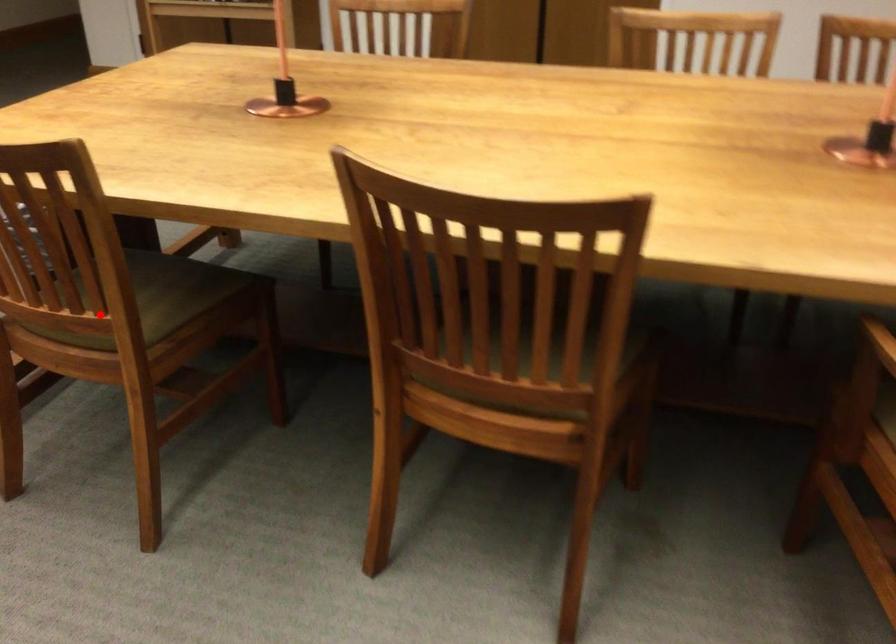
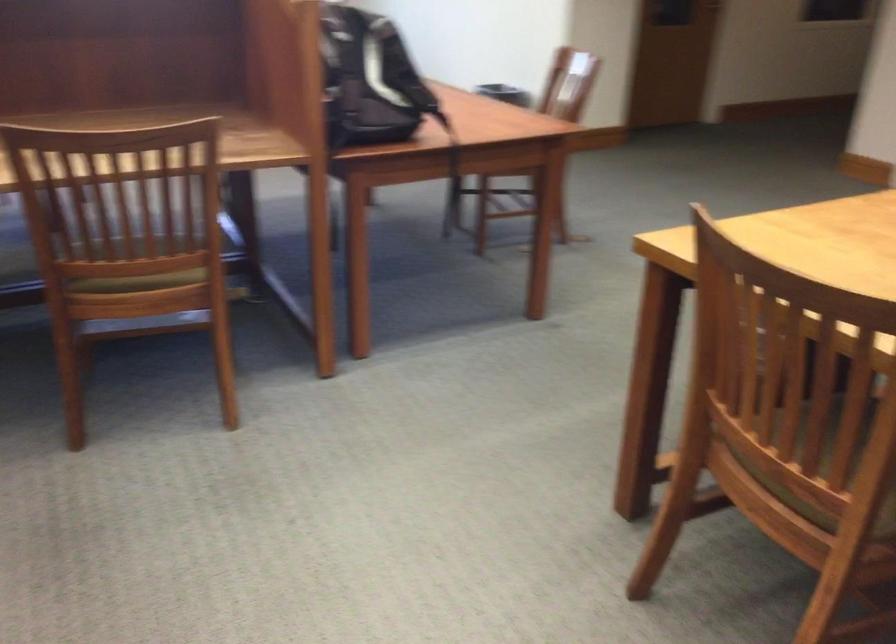
Where in the second image is the point corresponding to the highlighted location from the first image?

(823, 469)